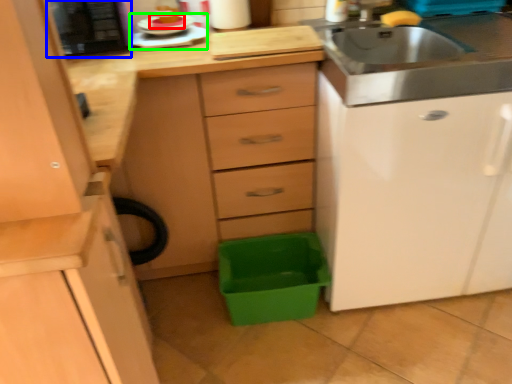
Question: Estimate the real-world distances between objects in this image. Which object is closer to food (highlighted by a red box), appliance (highlighted by a blue box) or appliance (highlighted by a green box)?

Choices:
 (A) appliance
 (B) appliance

Answer: (B)